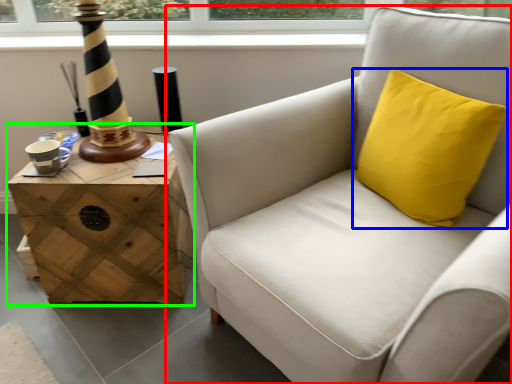
Question: Which object is the closest to the chair (highlighted by a red box)? Choose among these: pillow (highlighted by a blue box) or table (highlighted by a green box).

Choices:
 (A) pillow
 (B) table

Answer: (A)